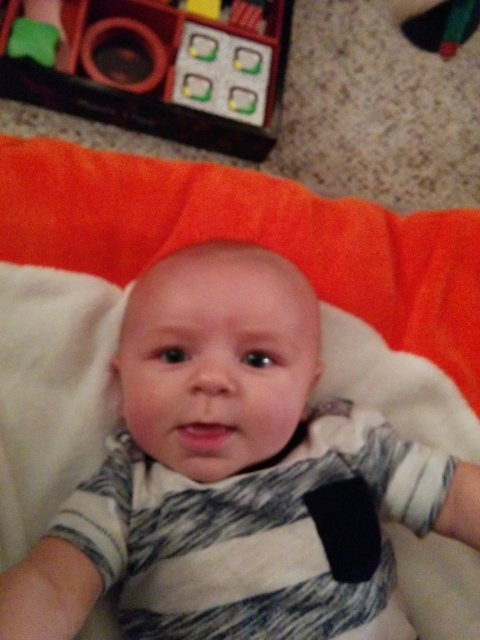
You are a photographer standing in front of the white soft baby at center. You want to take a closeup photo of the baby without getting too close. What is the minimum distance you should maintain to ensure the camera can focus properly?

The white soft baby at center is 17.78 inches away from viewer, so the minimum distance should be at least 17.78 inches to ensure proper focus.

You are a photographer setting up a shoot for a baby product catalog. You need to position the white soft baby at center and the matte plastic toy at upper left in a way that they are both visible but not overlapping. Given their sizes, which object should be placed closer to the camera to ensure both fit in the frame without overlapping?

The white soft baby at center is thinner than the matte plastic toy at upper left, so to prevent overlapping and ensure both fit in the frame, the thinner white soft baby at center should be placed closer to the camera while the larger matte plastic toy at upper left is positioned further back.